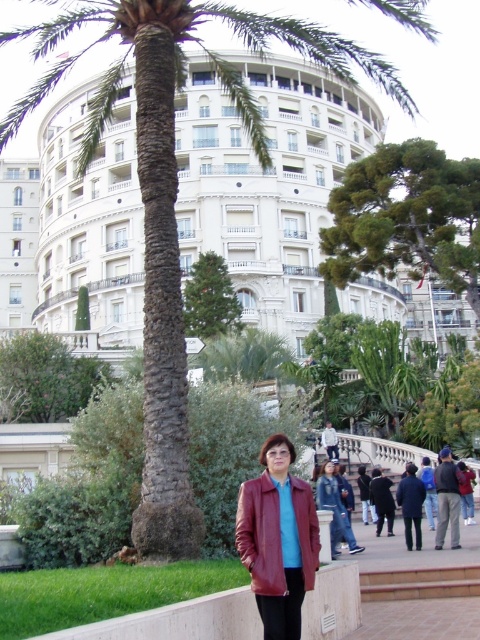
Question: Which object appears closest to the camera in this image?

Choices:
 (A) white glossy building at upper left
 (B) green textured tree at center

Answer: (A)

Question: Which of the following is the closest to the observer?

Choices:
 (A) (220, 268)
 (B) (263, 552)

Answer: (B)

Question: Can you confirm if white glossy building at upper left is wider than green textured tree at center?

Choices:
 (A) yes
 (B) no

Answer: (A)

Question: Does leather jacket at center appear on the left side of white glossy building at upper left?

Choices:
 (A) no
 (B) yes

Answer: (A)

Question: Is white glossy building at upper left bigger than green textured tree at center?

Choices:
 (A) no
 (B) yes

Answer: (B)

Question: Which point appears farthest from the camera in this image?

Choices:
 (A) (259, 515)
 (B) (192, 310)
 (C) (1, 228)

Answer: (C)